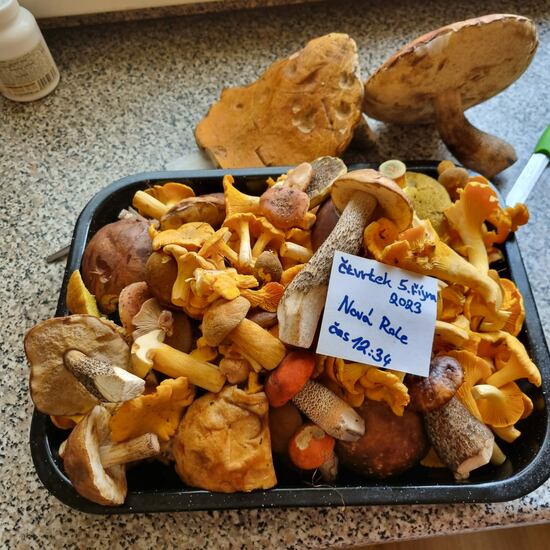
The width and height of the screenshot is (550, 550). I want to click on counter, so click(245, 540).